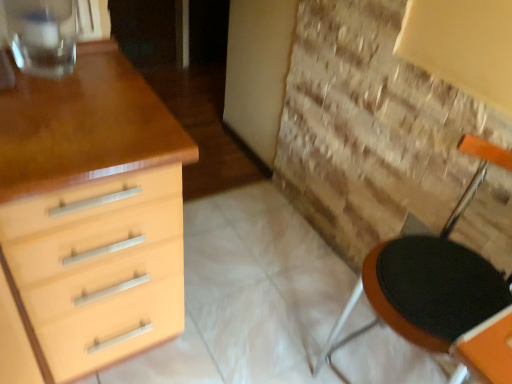
Where is `vacant space to the right of matte wood chest of drawers at left`? vacant space to the right of matte wood chest of drawers at left is located at coordinates (238, 323).